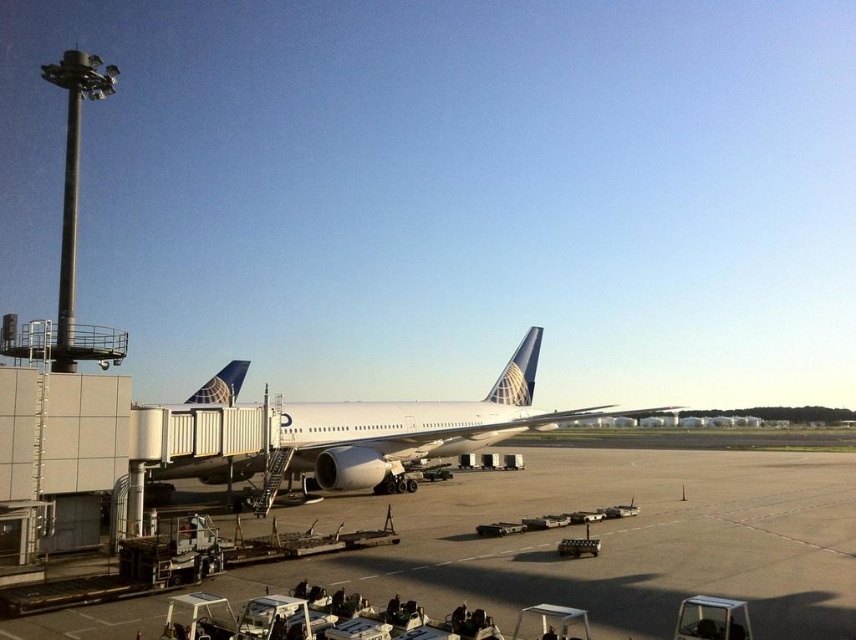
Between smooth concrete tarmac at center and white matte airplane at center, which one appears on the left side from the viewer's perspective?

From the viewer's perspective, white matte airplane at center appears more on the left side.

Is smooth concrete tarmac at center wider than white matte airplane at center?

In fact, smooth concrete tarmac at center might be narrower than white matte airplane at center.

Which is behind, point (568, 456) or point (507, 436)?

Point (568, 456)

Find the location of a particular element. The image size is (856, 640). smooth concrete tarmac at center is located at coordinates (613, 540).